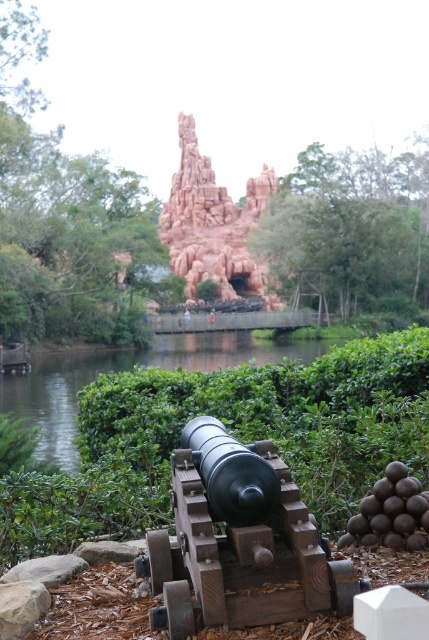
You are a park maintenance worker who needs to mow the lawn between the green leafy bush at center and the wooden cannon at center. Which object has a larger width to consider for the mowing path?

The green leafy bush at center might be wider than the wooden cannon at center, so you should consider the width of the green leafy bush at center when planning the mowing path.